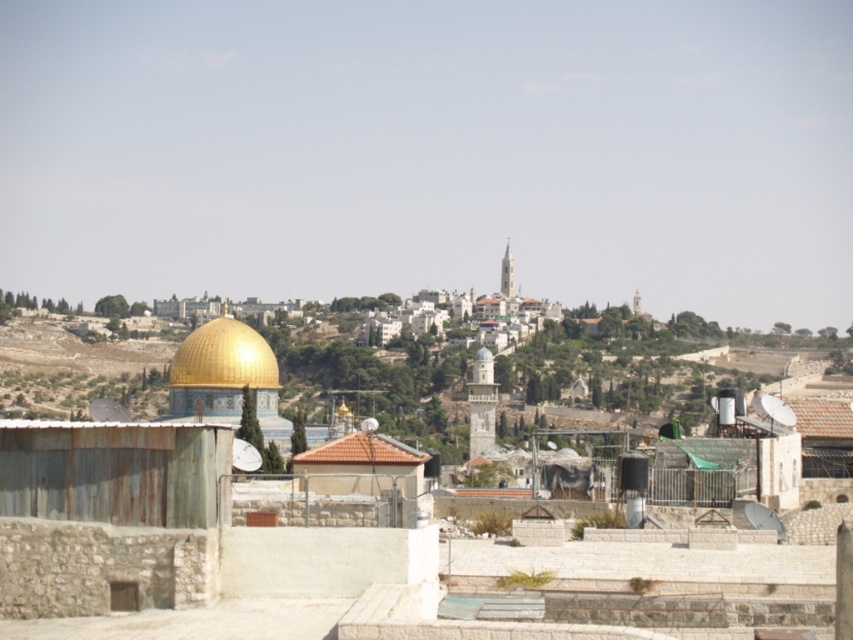
How distant is gold shiny dome at center from brown tile roof at center?

The distance of gold shiny dome at center from brown tile roof at center is 17.63 meters.

Does gold shiny dome at center appear on the left side of brown tile roof at center?

Indeed, gold shiny dome at center is positioned on the left side of brown tile roof at center.

Describe the element at coordinates (224, 356) in the screenshot. I see `gold shiny dome at center` at that location.

This screenshot has height=640, width=853. I want to click on gold shiny dome at center, so click(x=224, y=356).